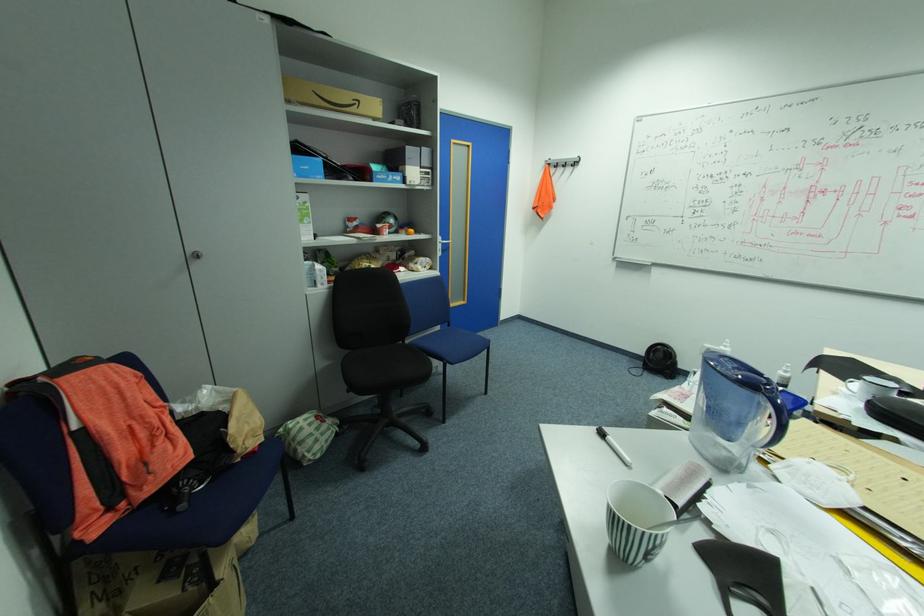
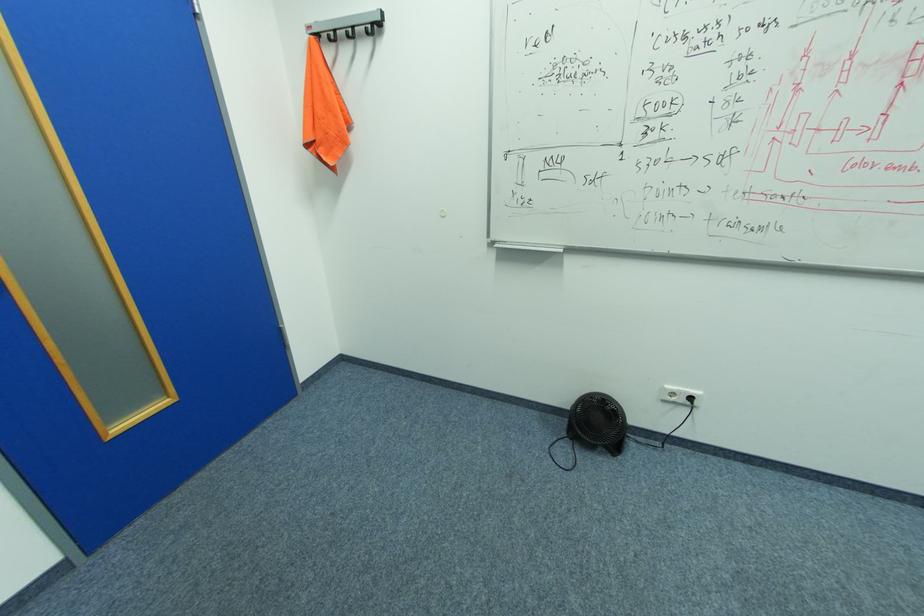
Find the pixel in the second image that matches pixel 648 363 in the first image.

(568, 423)